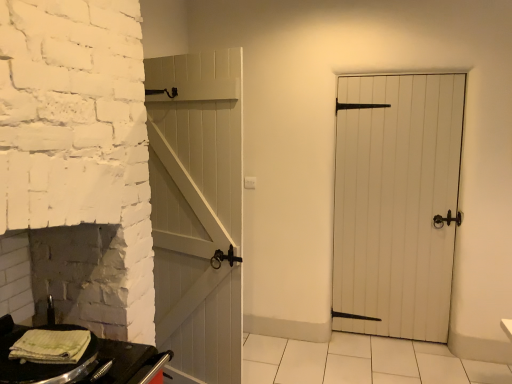
The width and height of the screenshot is (512, 384). Identify the location of green striped towel at lower left. (51, 346).

From a real-world perspective, is black matte table at lower left under green striped towel at lower left?

Correct, in the physical world, black matte table at lower left is lower than green striped towel at lower left.

Can you confirm if black matte table at lower left is smaller than green striped towel at lower left?

No.

How different are the orientations of black matte table at lower left and green striped towel at lower left in degrees?

black matte table at lower left and green striped towel at lower left are facing 21.9 degrees away from each other.

Considering the positions of objects black matte table at lower left and green striped towel at lower left in the image provided, who is in front, black matte table at lower left or green striped towel at lower left?

black matte table at lower left is in front.

Is white wooden door at center oriented away from green striped towel at lower left?

No.

Is white wooden door at center in front of or behind green striped towel at lower left in the image?

In the image, white wooden door at center appears behind green striped towel at lower left.

Measure the distance between white wooden door at center and green striped towel at lower left.

A distance of 7.63 feet exists between white wooden door at center and green striped towel at lower left.

What's the angular difference between white wooden door at center and green striped towel at lower left's facing directions?

They differ by 108 degrees in their facing directions.

The width and height of the screenshot is (512, 384). What are the coordinates of `material on the left side of white wooden door at center` in the screenshot? It's located at (51, 346).

Is point (75, 349) less distant than point (375, 223)?

Yes, it is in front of point (375, 223).

Is green striped towel at lower left taller or shorter than white wooden door at center?

Considering their sizes, green striped towel at lower left has less height than white wooden door at center.

From the image's perspective, relative to white wooden door at center, is green striped towel at lower left above or below?

green striped towel at lower left is below white wooden door at center.

Is black matte table at lower left inside or outside of white wooden door at center?

black matte table at lower left is spatially situated outside white wooden door at center.

Is black matte table at lower left at the left side of white wooden door at center?

Yes, black matte table at lower left is to the left of white wooden door at center.

This screenshot has height=384, width=512. Identify the location of door that is above the black matte table at lower left (from the image's perspective). (397, 203).

Is white wooden door at center shorter than black matte table at lower left?

No.

Locate an element on the screen. The height and width of the screenshot is (384, 512). table that is below the white wooden door at center (from the image's perspective) is located at coordinates (80, 361).

Consider the image. Can you confirm if white wooden door at center is bigger than black matte table at lower left?

Indeed, white wooden door at center has a larger size compared to black matte table at lower left.

Can black matte table at lower left be found inside white wooden door at center?

No, white wooden door at center does not contain black matte table at lower left.

Which of these two, green striped towel at lower left or black matte table at lower left, stands taller?

black matte table at lower left is taller.

Would you say green striped towel at lower left is outside black matte table at lower left?

No, green striped towel at lower left is inside black matte table at lower left's boundary.

Where is `material behind the black matte table at lower left`? Image resolution: width=512 pixels, height=384 pixels. material behind the black matte table at lower left is located at coordinates (51, 346).

Identify the location of material above the black matte table at lower left (from a real-world perspective). Image resolution: width=512 pixels, height=384 pixels. (51, 346).

Image resolution: width=512 pixels, height=384 pixels. What are the coordinates of `door above the green striped towel at lower left (from the image's perspective)` in the screenshot? It's located at (397, 203).

Which object lies nearer to the anchor point green striped towel at lower left, white wooden door at center or black matte table at lower left?

black matte table at lower left lies closer to green striped towel at lower left than the other object.

Estimate the real-world distances between objects in this image. Which object is further from black matte table at lower left, white wooden door at center or green striped towel at lower left?

white wooden door at center lies further to black matte table at lower left than the other object.

Which object lies further to the anchor point white wooden door at center, green striped towel at lower left or black matte table at lower left?

green striped towel at lower left is positioned further to the anchor white wooden door at center.

When comparing their distances from white wooden door at center, does black matte table at lower left or green striped towel at lower left seem closer?

Among the two, black matte table at lower left is located nearer to white wooden door at center.

Estimate the real-world distances between objects in this image. Which object is closer to black matte table at lower left, green striped towel at lower left or white wooden door at center?

Based on the image, green striped towel at lower left appears to be nearer to black matte table at lower left.

Looking at the image, which one is located further to green striped towel at lower left, black matte table at lower left or white wooden door at center?

white wooden door at center is positioned further to the anchor green striped towel at lower left.

Identify the location of material between black matte table at lower left and white wooden door at center. The image size is (512, 384). (51, 346).